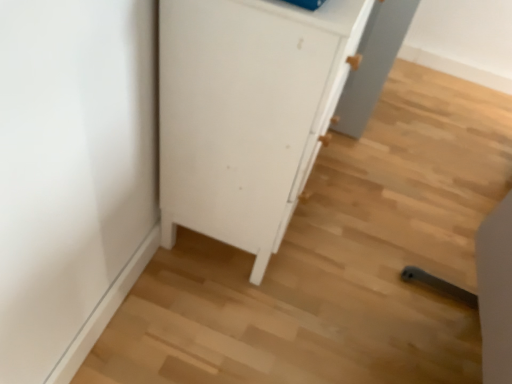
Question: Which is correct: white matte cabinet at center is inside light wood chair at lower right, or outside of it?

Choices:
 (A) outside
 (B) inside

Answer: (A)

Question: From the image's perspective, relative to light wood chair at lower right, is white matte cabinet at center above or below?

Choices:
 (A) below
 (B) above

Answer: (B)

Question: Considering the positions of white matte cabinet at center and light wood chair at lower right in the image, is white matte cabinet at center taller or shorter than light wood chair at lower right?

Choices:
 (A) tall
 (B) short

Answer: (A)

Question: Considering their positions, is light wood chair at lower right located in front of or behind white matte cabinet at center?

Choices:
 (A) front
 (B) behind

Answer: (A)

Question: In terms of size, does light wood chair at lower right appear bigger or smaller than white matte cabinet at center?

Choices:
 (A) small
 (B) big

Answer: (A)

Question: Considering the relative positions of light wood chair at lower right and white matte cabinet at center in the image provided, is light wood chair at lower right to the left or to the right of white matte cabinet at center?

Choices:
 (A) right
 (B) left

Answer: (A)

Question: Does point (485, 248) appear closer or farther from the camera than point (296, 69)?

Choices:
 (A) closer
 (B) farther

Answer: (B)